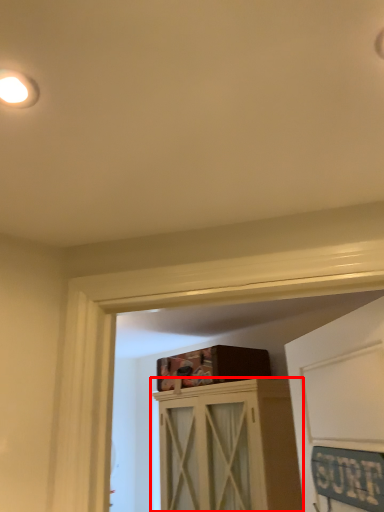
Question: From the image's perspective, where is cabinetry (annotated by the red box) located relative to droplight?

Choices:
 (A) below
 (B) above

Answer: (A)